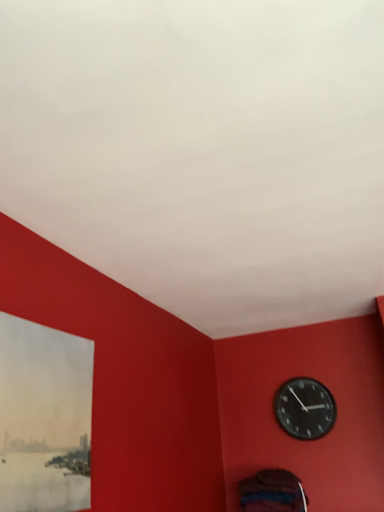
Question: Is matte paper picture frame at lower left further to the viewer compared to black matte wall clock at upper right?

Choices:
 (A) yes
 (B) no

Answer: (B)

Question: Is matte paper picture frame at lower left positioned with its back to black matte wall clock at upper right?

Choices:
 (A) no
 (B) yes

Answer: (A)

Question: Does matte paper picture frame at lower left lie in front of black matte wall clock at upper right?

Choices:
 (A) no
 (B) yes

Answer: (B)

Question: Is matte paper picture frame at lower left completely or partially outside of black matte wall clock at upper right?

Choices:
 (A) no
 (B) yes

Answer: (B)

Question: Is matte paper picture frame at lower left surrounding black matte wall clock at upper right?

Choices:
 (A) no
 (B) yes

Answer: (A)

Question: From the image's perspective, is matte paper picture frame at lower left below black matte wall clock at upper right?

Choices:
 (A) yes
 (B) no

Answer: (B)

Question: Are black matte wall clock at upper right and matte paper picture frame at lower left far apart?

Choices:
 (A) yes
 (B) no

Answer: (A)

Question: From the image's perspective, is black matte wall clock at upper right on top of matte paper picture frame at lower left?

Choices:
 (A) yes
 (B) no

Answer: (B)

Question: Considering the relative positions of black matte wall clock at upper right and matte paper picture frame at lower left in the image provided, is black matte wall clock at upper right in front of matte paper picture frame at lower left?

Choices:
 (A) yes
 (B) no

Answer: (B)

Question: Is black matte wall clock at upper right wider than matte paper picture frame at lower left?

Choices:
 (A) yes
 (B) no

Answer: (A)

Question: From the image's perspective, is black matte wall clock at upper right located beneath matte paper picture frame at lower left?

Choices:
 (A) yes
 (B) no

Answer: (A)

Question: Is matte paper picture frame at lower left located within black matte wall clock at upper right?

Choices:
 (A) yes
 (B) no

Answer: (B)

Question: Considering the relative positions of matte paper picture frame at lower left and black matte wall clock at upper right in the image provided, is matte paper picture frame at lower left to the left or to the right of black matte wall clock at upper right?

Choices:
 (A) right
 (B) left

Answer: (B)